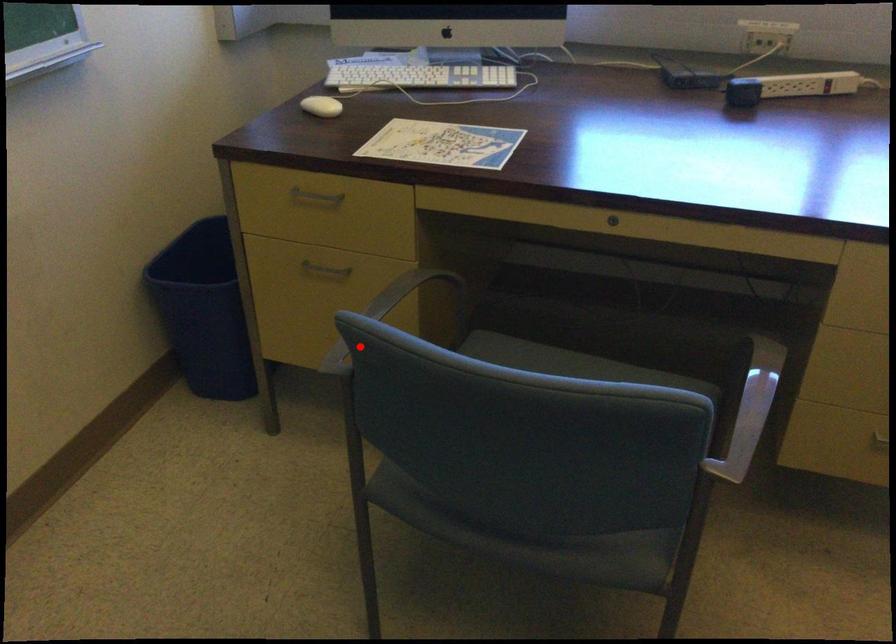
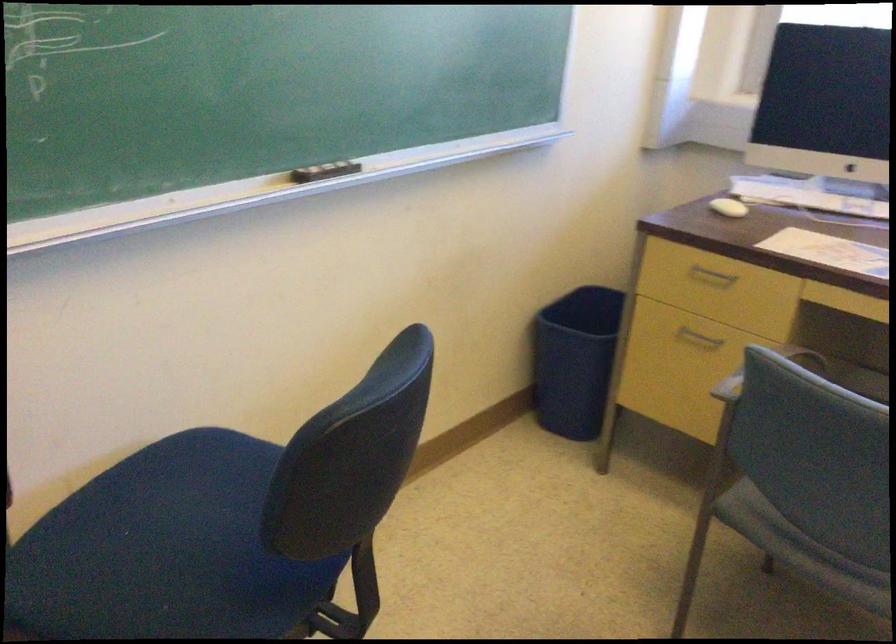
The point at the highlighted location is marked in the first image. Where is the corresponding point in the second image?

(764, 371)